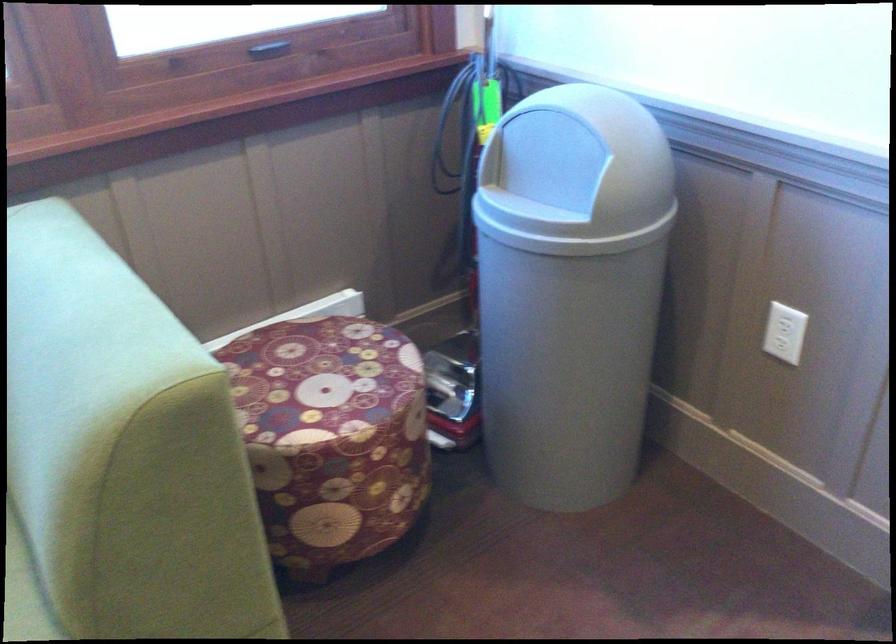
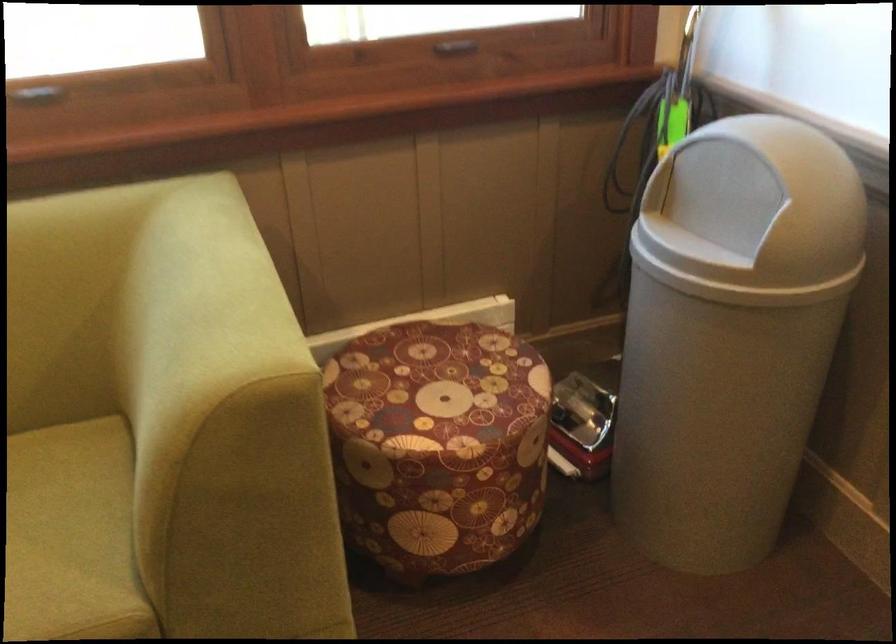
Question: How did the camera likely rotate?

Choices:
 (A) Left
 (B) Right
 (C) Up
 (D) Down

Answer: (A)